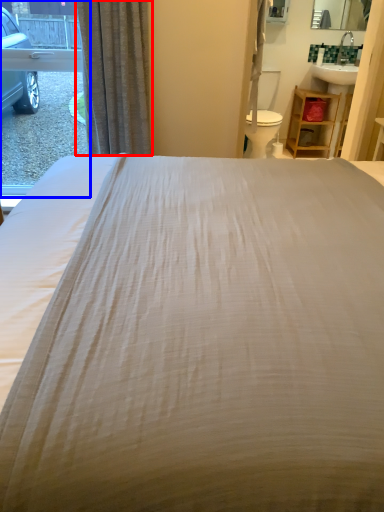
Question: Which point is closer to the camera, curtain (highlighted by a red box) or window (highlighted by a blue box)?

Choices:
 (A) curtain
 (B) window

Answer: (A)